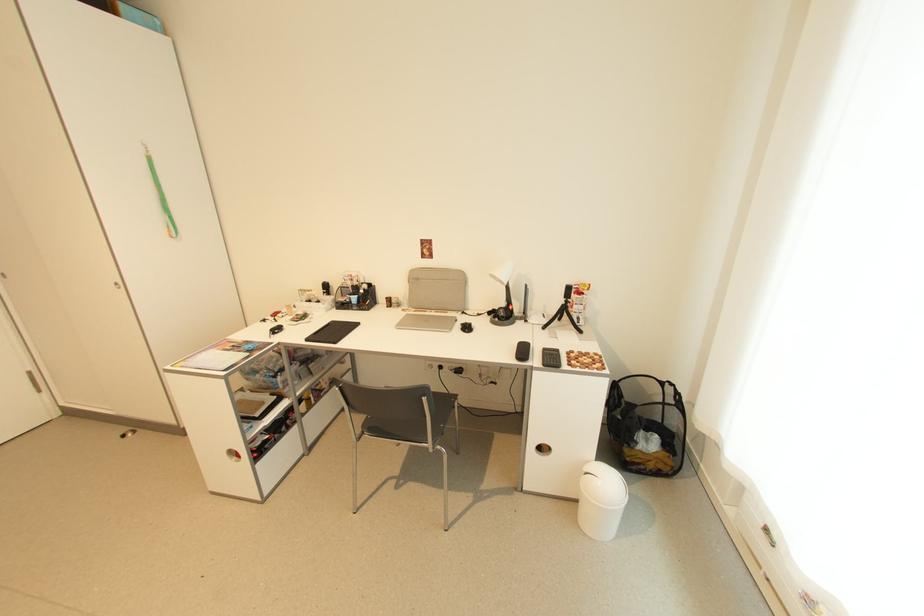
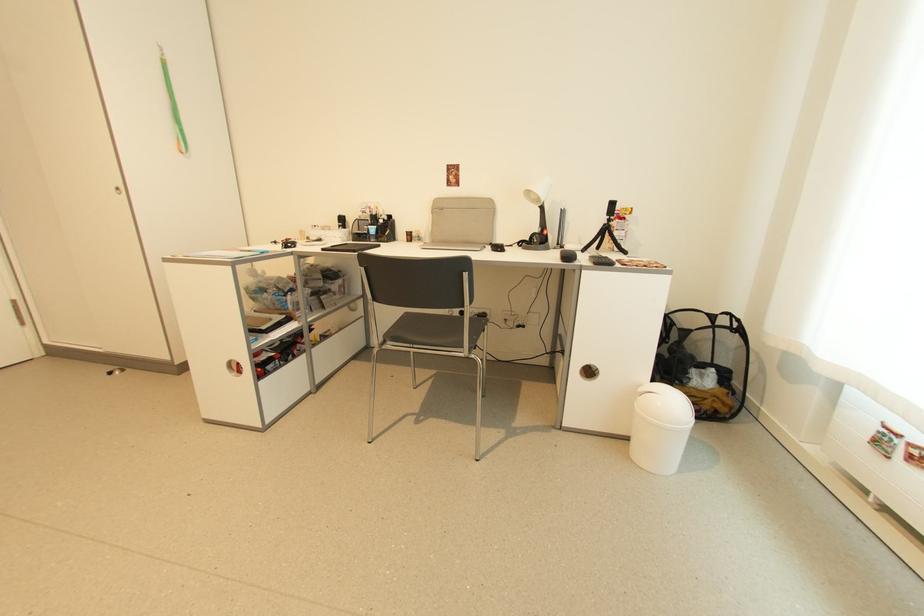
The point at [367,428] is marked in the first image. Where is the corresponding point in the second image?

(388, 337)